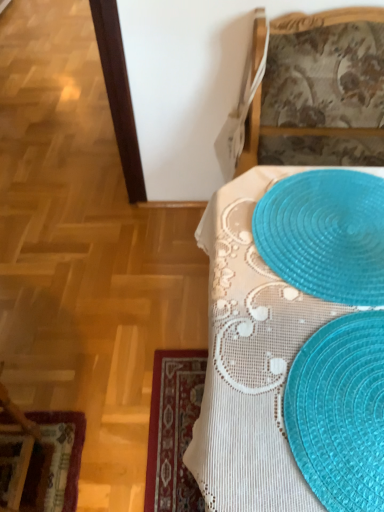
Question: Does translucent plastic placemats at lower right come behind translucent plastic placemat at upper right?

Choices:
 (A) yes
 (B) no

Answer: (B)

Question: Is translucent plastic placemats at lower right directly adjacent to translucent plastic placemat at upper right?

Choices:
 (A) no
 (B) yes

Answer: (A)

Question: Is translucent plastic placemats at lower right not near translucent plastic placemat at upper right?

Choices:
 (A) no
 (B) yes

Answer: (A)

Question: Does translucent plastic placemats at lower right appear on the right side of translucent plastic placemat at upper right?

Choices:
 (A) no
 (B) yes

Answer: (A)

Question: Does translucent plastic placemats at lower right have a lesser height compared to translucent plastic placemat at upper right?

Choices:
 (A) no
 (B) yes

Answer: (A)

Question: Is translucent plastic placemats at lower right facing towards translucent plastic placemat at upper right?

Choices:
 (A) no
 (B) yes

Answer: (A)

Question: Can you confirm if translucent plastic placemats at lower right is smaller than translucent plastic placemat at upper right?

Choices:
 (A) yes
 (B) no

Answer: (A)

Question: Is translucent plastic placemats at lower right in contact with translucent plastic placemat at upper right?

Choices:
 (A) yes
 (B) no

Answer: (B)

Question: Is translucent plastic placemats at lower right at the left side of translucent plastic placemat at upper right?

Choices:
 (A) yes
 (B) no

Answer: (A)

Question: Does translucent plastic placemats at lower right appear on the right side of translucent plastic placemat at upper right?

Choices:
 (A) yes
 (B) no

Answer: (B)

Question: Considering the relative sizes of translucent plastic placemats at lower right and translucent plastic placemat at upper right in the image provided, is translucent plastic placemats at lower right shorter than translucent plastic placemat at upper right?

Choices:
 (A) yes
 (B) no

Answer: (A)

Question: Is translucent plastic placemats at lower right not close to translucent plastic placemat at upper right?

Choices:
 (A) yes
 (B) no

Answer: (B)

Question: Considering the relative sizes of translucent plastic placemat at upper right and translucent blue placemat at lower right in the image provided, is translucent plastic placemat at upper right wider than translucent blue placemat at lower right?

Choices:
 (A) no
 (B) yes

Answer: (A)